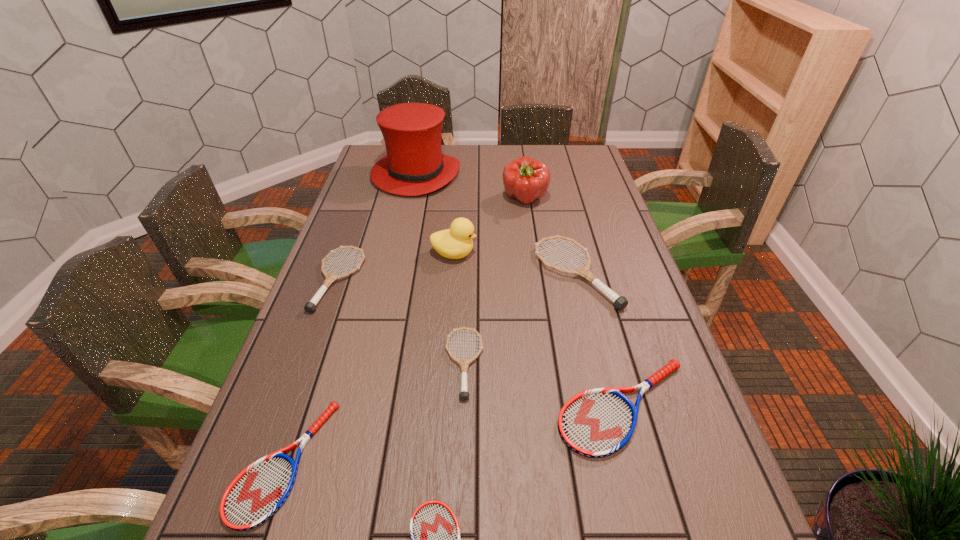
The width and height of the screenshot is (960, 540). In order to click on free space located 0.220m on the back of the rightmost blue tennis racket in this screenshot , I will do `click(594, 298)`.

You are a GUI agent. You are given a task and a screenshot of the screen. Output one action in this format:
    pyautogui.click(x=<x>, y=<y>)
    Task: Click on the vacant region located 0.220m on the right of the second smallest blue tennis racket
    This screenshot has height=540, width=960.
    Given the screenshot: What is the action you would take?
    pyautogui.click(x=439, y=461)

Locate an element on the screen. This screenshot has width=960, height=540. object that is at the far edge is located at coordinates (414, 165).

You are a GUI agent. You are given a task and a screenshot of the screen. Output one action in this format:
    pyautogui.click(x=<x>, y=<y>)
    Task: Click on the hat situated at the left edge
    This screenshot has height=540, width=960.
    Given the screenshot: What is the action you would take?
    pyautogui.click(x=414, y=165)

You are a GUI agent. You are given a task and a screenshot of the screen. Output one action in this format:
    pyautogui.click(x=<x>, y=<y>)
    Task: Click on the object located in the far left corner section of the desktop
    
    Given the screenshot: What is the action you would take?
    pyautogui.click(x=414, y=165)

In the image, there is a desktop. Identify the location of vacant space at the far edge. (538, 157).

Identify the location of free region at the left edge of the desktop. The height and width of the screenshot is (540, 960). point(298,413).

In the image, there is a desktop. At what (x,y) coordinates should I click in order to perform the action: click on vacant area at the right edge. Please return your answer as a coordinate pair (x, y). The image size is (960, 540). Looking at the image, I should click on (602, 324).

What are the coordinates of `vacant area at the far left corner` in the screenshot? It's located at (368, 163).

Where is `unoccupied position between the seventh shortest object and the pink pepper`? Image resolution: width=960 pixels, height=540 pixels. unoccupied position between the seventh shortest object and the pink pepper is located at coordinates (490, 227).